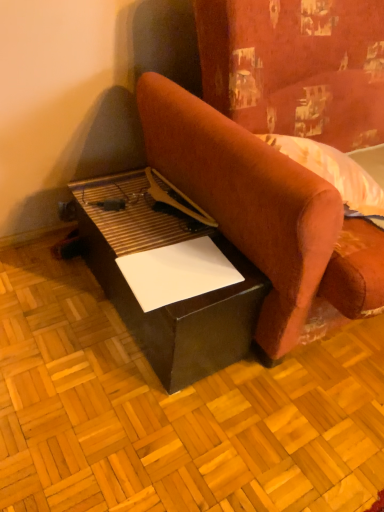
The height and width of the screenshot is (512, 384). Identify the location of free space to the left of black leather table at lower left. (48, 305).